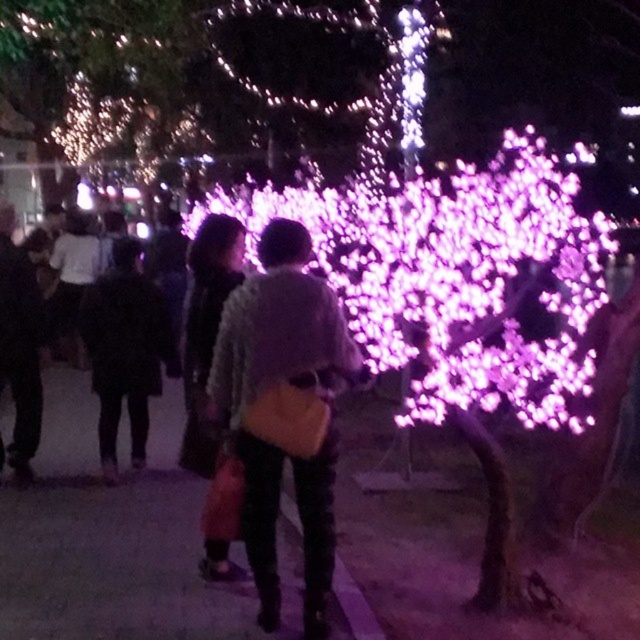
Can you confirm if purple illuminated tree at center is positioned to the right of illuminated plastic tree at upper left?

Indeed, purple illuminated tree at center is positioned on the right side of illuminated plastic tree at upper left.

Where is `purple illuminated tree at center`? The image size is (640, 640). purple illuminated tree at center is located at coordinates pyautogui.click(x=460, y=276).

Between point (445, 205) and point (81, 42), which one is positioned in front?

Point (445, 205) is in front.

You are a GUI agent. You are given a task and a screenshot of the screen. Output one action in this format:
    pyautogui.click(x=<x>, y=<y>)
    Task: Click on the purple illuminated tree at center
    This screenshot has height=640, width=640.
    Given the screenshot: What is the action you would take?
    pyautogui.click(x=460, y=276)

Between purple illuminated tree at center and black leather jacket at left, which one appears on the right side from the viewer's perspective?

From the viewer's perspective, purple illuminated tree at center appears more on the right side.

Between point (474, 368) and point (147, 416), which one is positioned in front?

Positioned in front is point (474, 368).

You are a GUI agent. You are given a task and a screenshot of the screen. Output one action in this format:
    pyautogui.click(x=<x>, y=<y>)
    Task: Click on the purple illuminated tree at center
    
    Given the screenshot: What is the action you would take?
    pyautogui.click(x=460, y=276)

Is matte yellow bag at center below black leather jacket at left?

Correct, matte yellow bag at center is located below black leather jacket at left.

Between matte yellow bag at center and black leather jacket at left, which one has less height?

black leather jacket at left is shorter.

Is point (320, 632) in front of point (136, 241)?

Yes, it is.

Find the location of `matte yellow bag at center`. matte yellow bag at center is located at coordinates (289, 388).